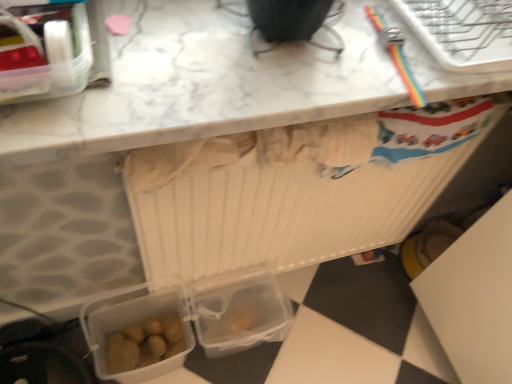
Find the location of a particular element. This screenshot has height=384, width=512. free space that is in between translucent plastic lunch box at upper left, arranged as the 1th lunch box when viewed from the front, and rainbow plastic bracelet at upper right is located at coordinates (239, 57).